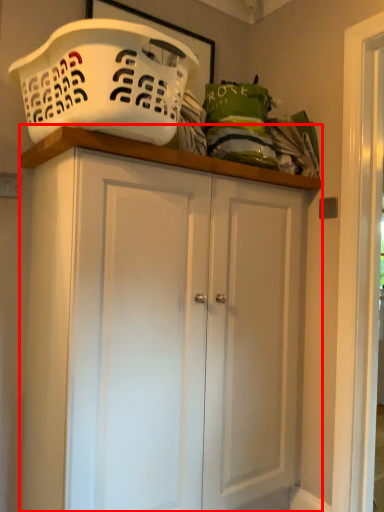
Question: In this image, where is cupboard (annotated by the red box) located relative to basket container?

Choices:
 (A) left
 (B) right

Answer: (B)